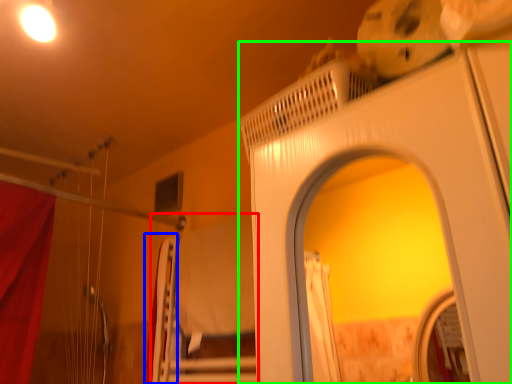
Question: Based on their relative distances, which object is farther from bed (highlighted by a red box)? Choose from curtain (highlighted by a blue box) and screen door (highlighted by a green box).

Choices:
 (A) curtain
 (B) screen door

Answer: (B)